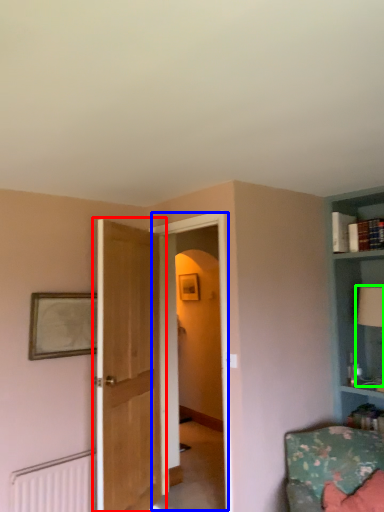
Question: Which is nearer to the door (highlighted by a red box)? glass door (highlighted by a blue box) or table lamp (highlighted by a green box).

Choices:
 (A) glass door
 (B) table lamp

Answer: (A)